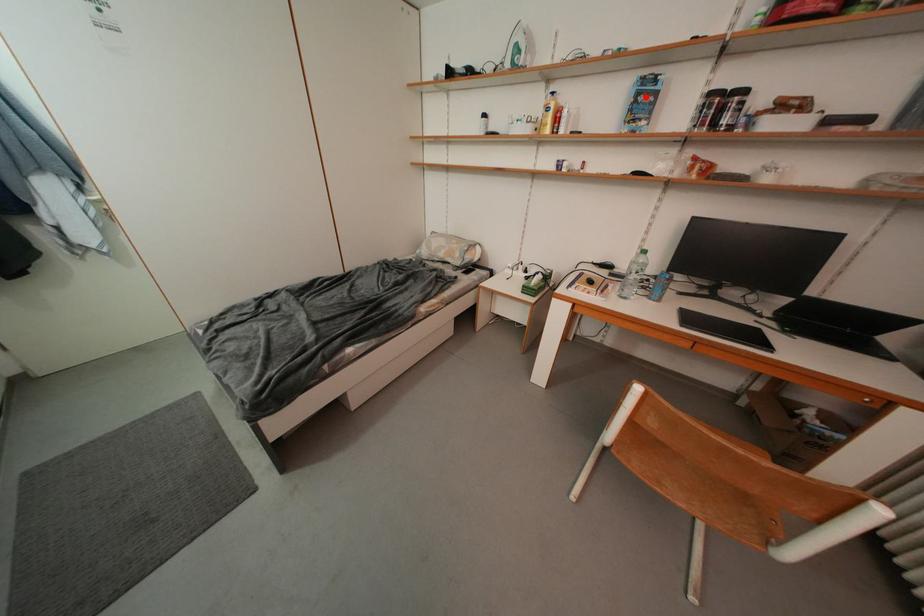
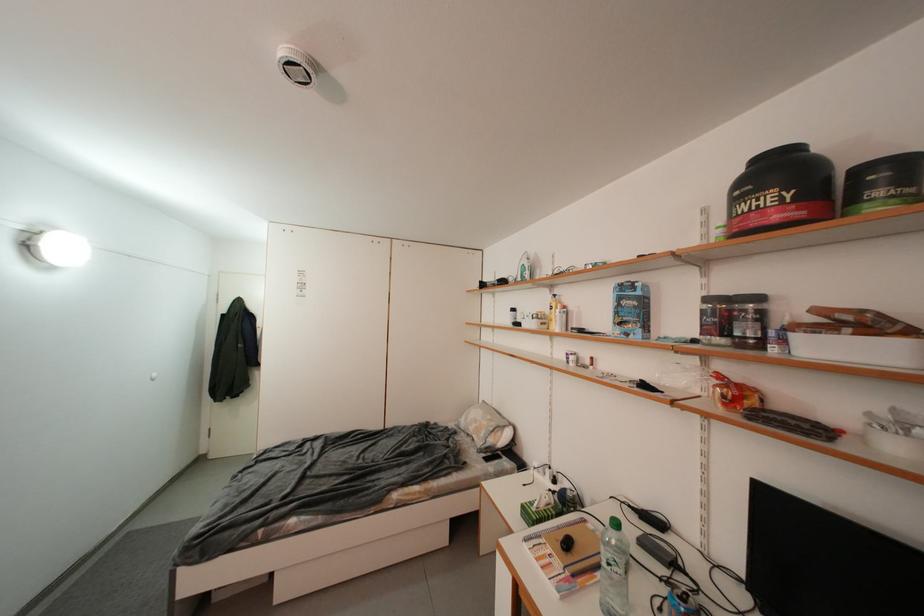
Locate, in the second image, the point that corresponds to the highlighted location in the first image.

(627, 302)